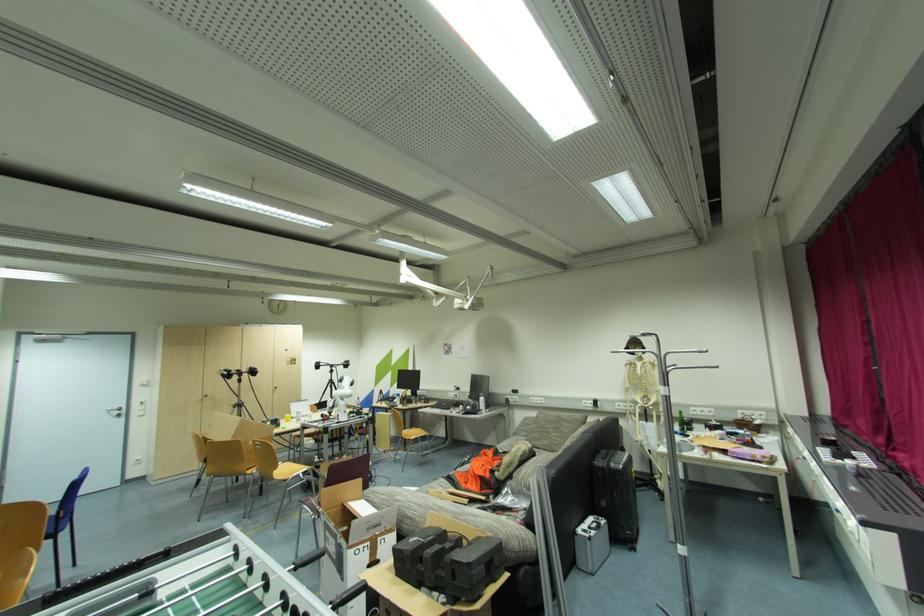
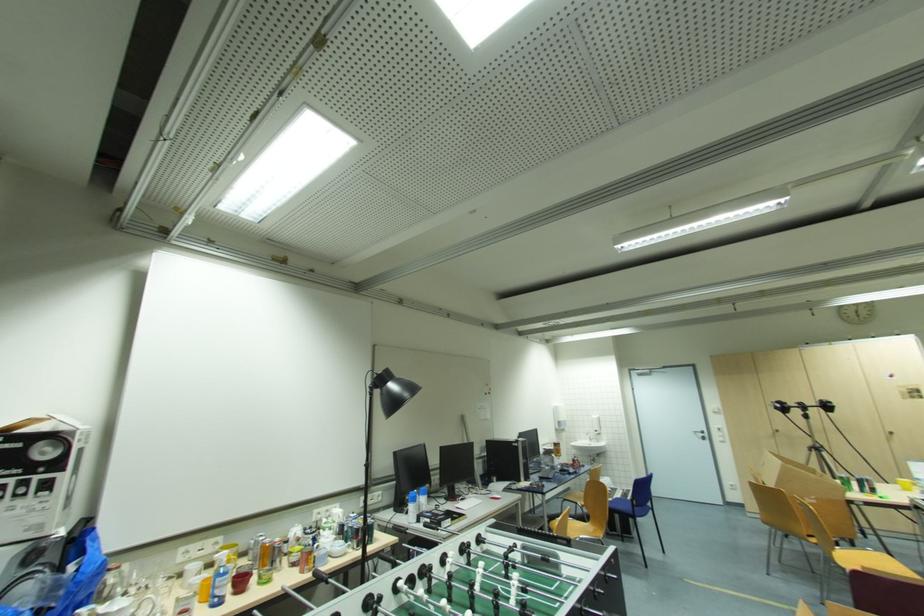
Where in the second image is the point corresponding to pixel 122 413 from the first image?

(706, 436)